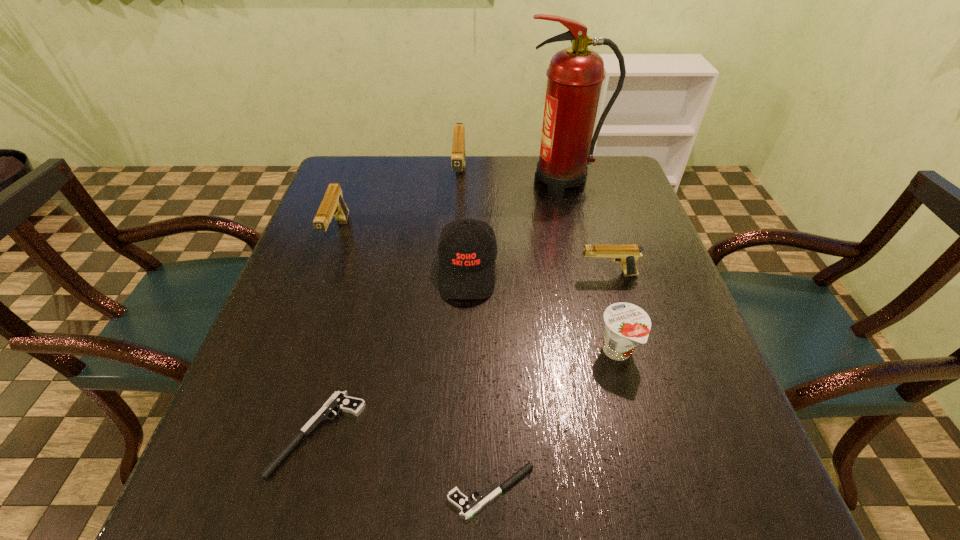
Find the location of a particular element. vacant area at the far right corner of the desktop is located at coordinates (600, 157).

Locate an element on the screen. The height and width of the screenshot is (540, 960). free area in between the sixth farthest object and the bigger black pistol is located at coordinates (468, 393).

At what (x,y) coordinates should I click in order to perform the action: click on empty space that is in between the rightmost pistol and the tallest object. Please return your answer as a coordinate pair (x, y). Looking at the image, I should click on (586, 228).

Find the location of a particular element. unoccupied position between the smaller black pistol and the fire extinguisher is located at coordinates (527, 336).

Locate an element on the screen. Image resolution: width=960 pixels, height=540 pixels. vacant area between the seventh object from right to left and the smaller black pistol is located at coordinates (405, 462).

This screenshot has width=960, height=540. Find the location of `free space between the bigger black pistol and the third farthest pistol`. free space between the bigger black pistol and the third farthest pistol is located at coordinates (463, 354).

Locate an element on the screen. This screenshot has height=540, width=960. empty space that is in between the red fire extinguisher and the third nearest object is located at coordinates (590, 267).

The image size is (960, 540). I want to click on free area in between the second smallest tan pistol and the baseball cap, so click(x=402, y=253).

Where is `empty location between the bigger black pistol and the yogurt`? The height and width of the screenshot is (540, 960). empty location between the bigger black pistol and the yogurt is located at coordinates (468, 393).

Where is `vacant space that's between the seventh object from right to left and the fourth shortest pistol`? The width and height of the screenshot is (960, 540). vacant space that's between the seventh object from right to left and the fourth shortest pistol is located at coordinates (328, 335).